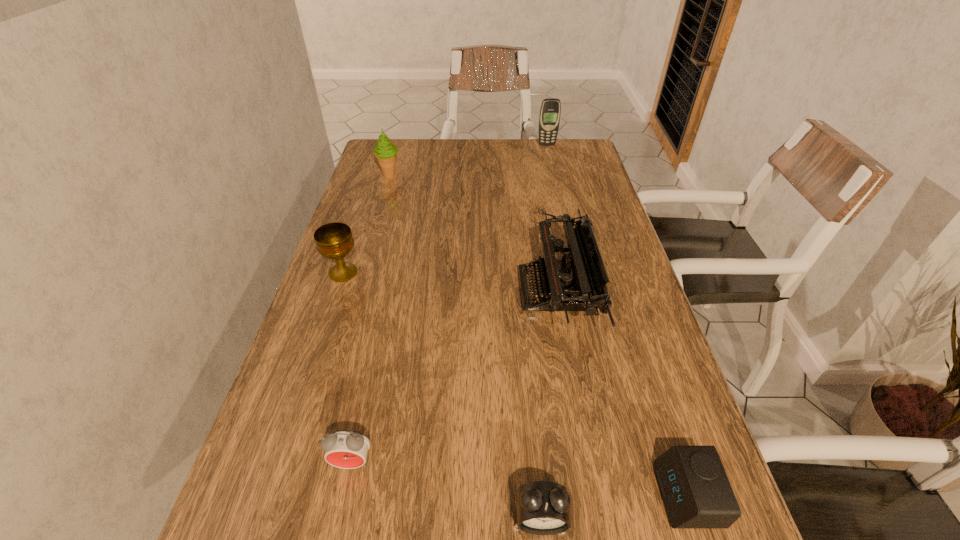
At what (x,y) coordinates should I click in order to perform the action: click on free space between the rightmost object and the fifth object from right to left. Please return your answer as a coordinate pair (x, y). This screenshot has width=960, height=540. Looking at the image, I should click on (519, 478).

Where is `object that ranks as the fifth closest to the fifth object from right to left`? The width and height of the screenshot is (960, 540). object that ranks as the fifth closest to the fifth object from right to left is located at coordinates (385, 152).

Choose which object is the second nearest neighbor to the leftmost alarm clock. Please provide its 2D coordinates. Your answer should be formatted as a tuple, i.e. [(x, y)], where the tuple contains the x and y coordinates of a point satisfying the conditions above.

[(577, 282)]

This screenshot has width=960, height=540. I want to click on alarm clock that stands as the second closest to the shortest alarm clock, so click(347, 449).

You are a GUI agent. You are given a task and a screenshot of the screen. Output one action in this format:
    pyautogui.click(x=<x>, y=<y>)
    Task: Click on the alarm clock that is the third closest to the farthest object
    
    Given the screenshot: What is the action you would take?
    pyautogui.click(x=542, y=507)